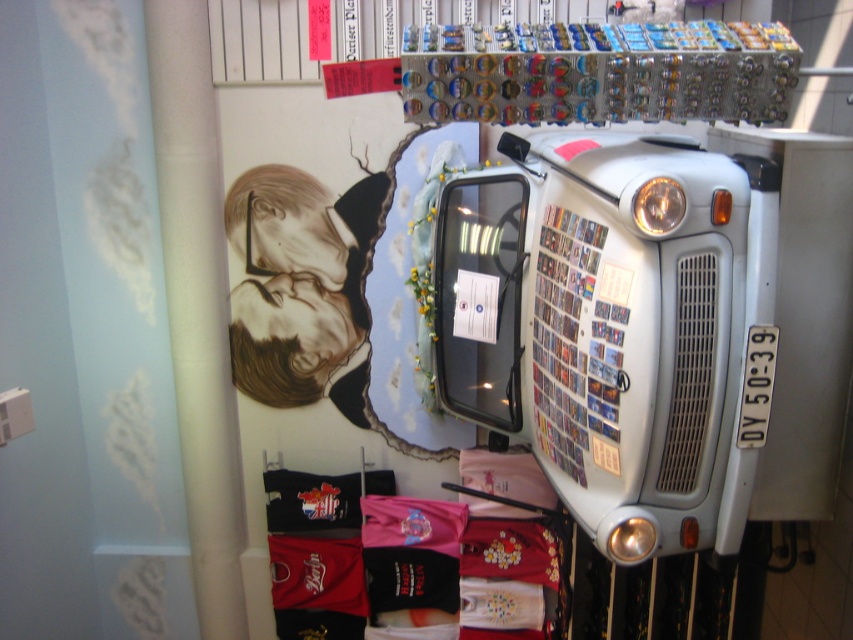
You are a delivery person with a package that is 1.5 meters long. You need to place it between the light gray metallic truck at center and the white matte pillar at left. Is there enough space to fit the package horizontally between them?

The light gray metallic truck at center and white matte pillar at left are 1.57 meters apart, so the package that is 1.5 meters long can fit horizontally between them since the distance is slightly larger than the package length.

You are a customer entering the shop and want to take a photo of the light gray metallic truck at center without any obstructions. Is the white matte pillar at left blocking your view of the truck?

The light gray metallic truck at center is positioned over the white matte pillar at left, so the pillar is blocking part of the truck. Move to a different angle to get an unobstructed view.